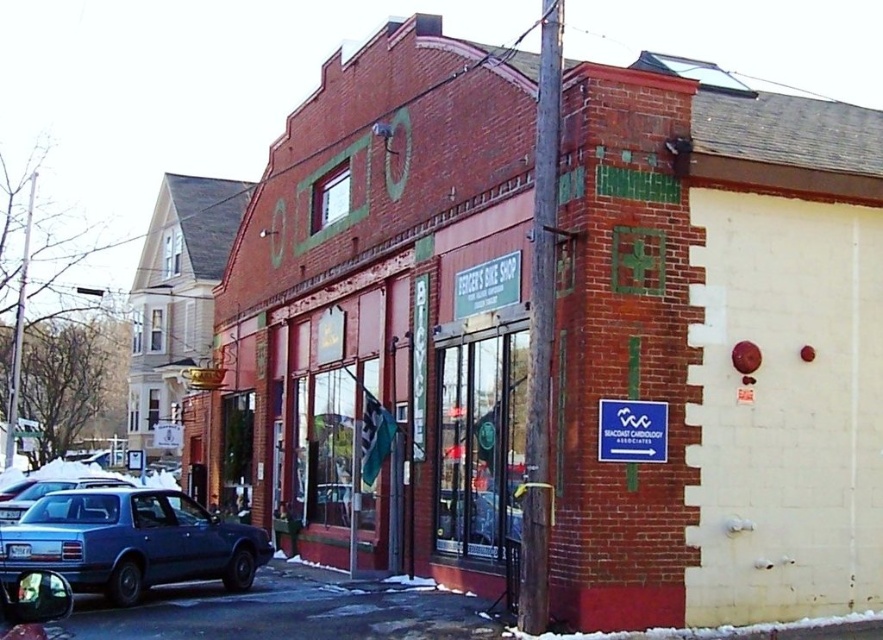
You are a customer arriving at the Bicycle Shop and see the matte blue sedan at lower left and the blue plastic sign at center. Which object is located below the other?

The matte blue sedan at lower left is positioned under the blue plastic sign at center.